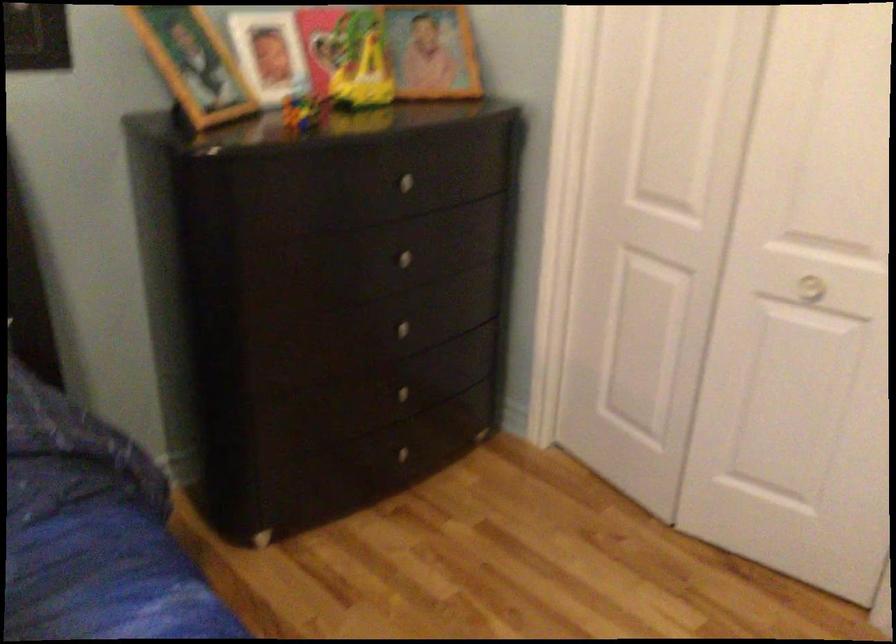
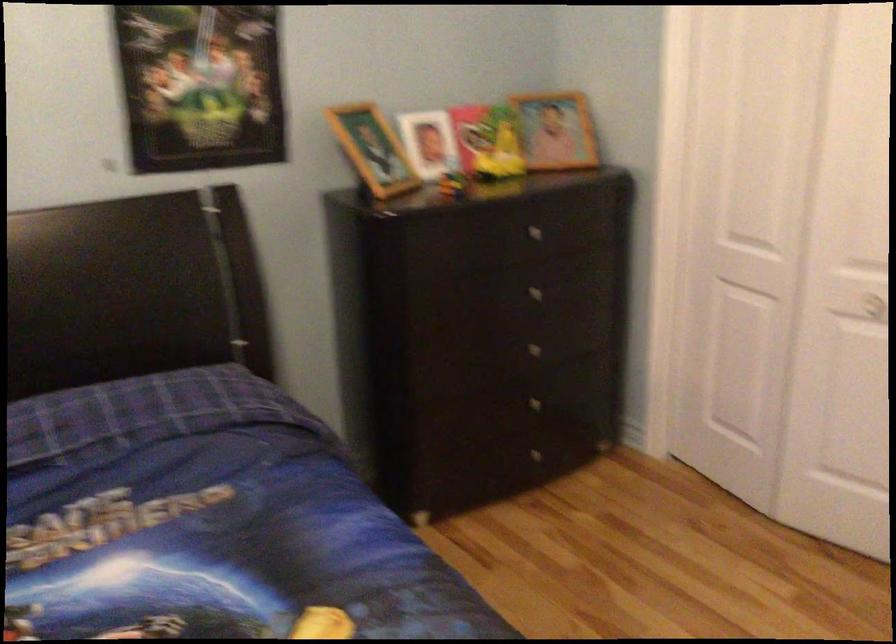
In the second image, find the point that corresponds to [789,290] in the first image.

(864, 305)